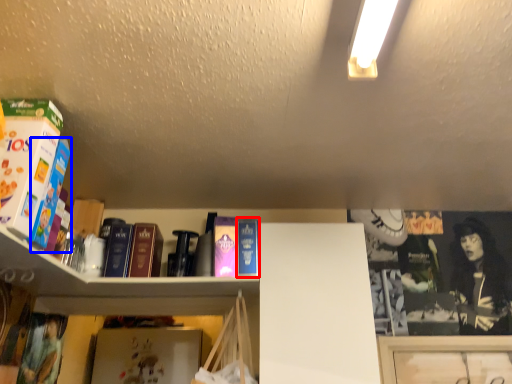
Question: Which of the following is the closest to the observer, paperback book (highlighted by a red box) or book (highlighted by a blue box)?

Choices:
 (A) paperback book
 (B) book

Answer: (B)